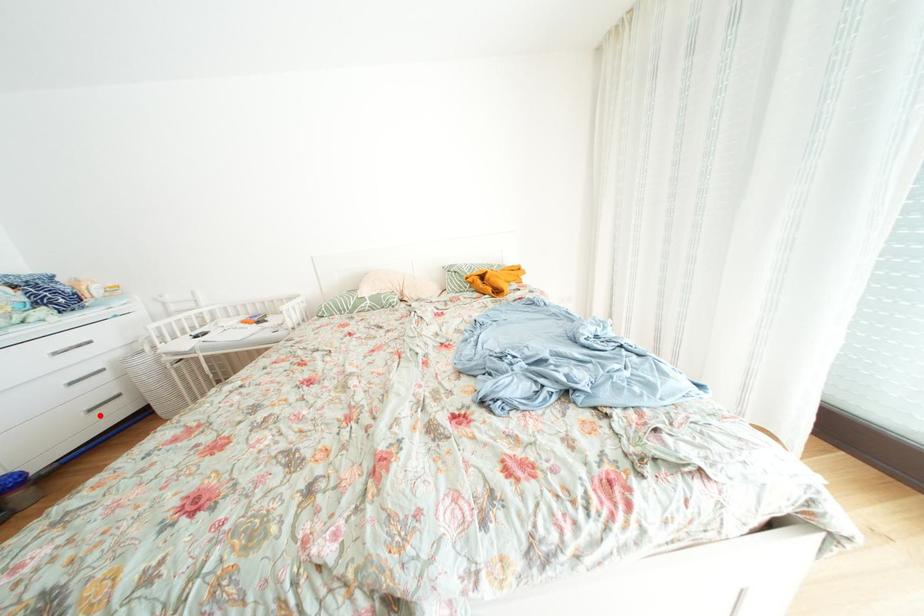
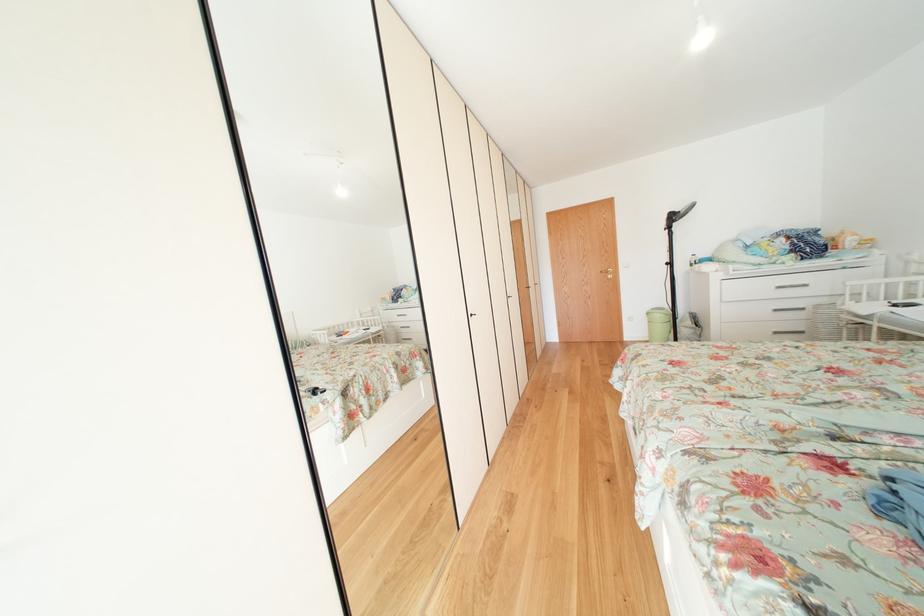
In the second image, find the point that corresponds to the highlighted location in the first image.

(784, 338)